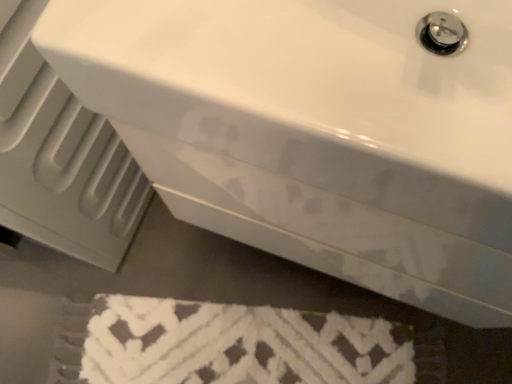
What is the approximate height of white textured bath towel at lower center?

The height of white textured bath towel at lower center is 2.47 centimeters.

What do you see at coordinates (239, 345) in the screenshot? The image size is (512, 384). I see `white textured bath towel at lower center` at bounding box center [239, 345].

The width and height of the screenshot is (512, 384). Find the location of `white textured bath towel at lower center`. white textured bath towel at lower center is located at coordinates (239, 345).

The image size is (512, 384). What are the coordinates of `white textured bath towel at lower center` in the screenshot? It's located at (239, 345).